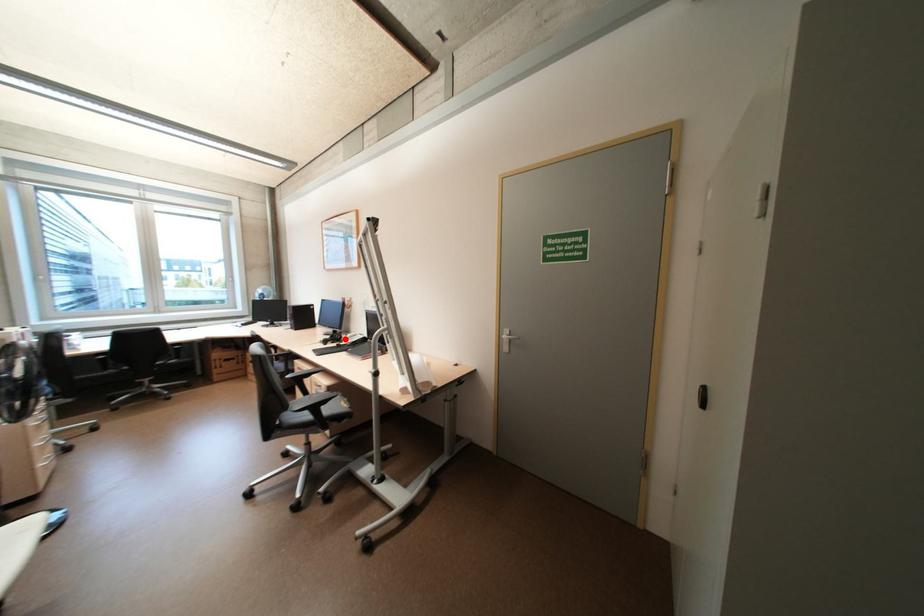
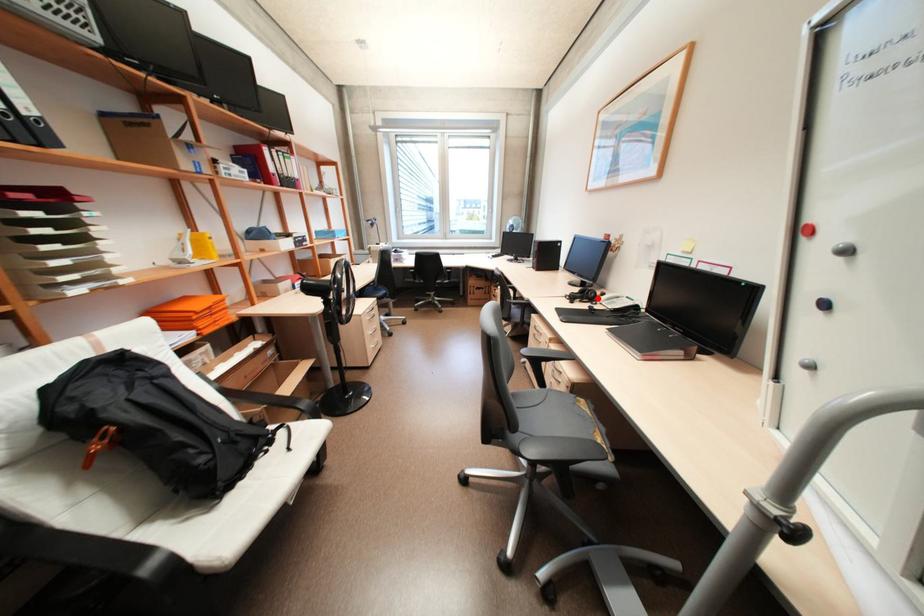
I am providing you with two images of the same scene from different viewpoints. A red point is marked on the first image and another point is marked on the second image. Do the highlighted points in image1 and image2 indicate the same real-world spot?

Yes